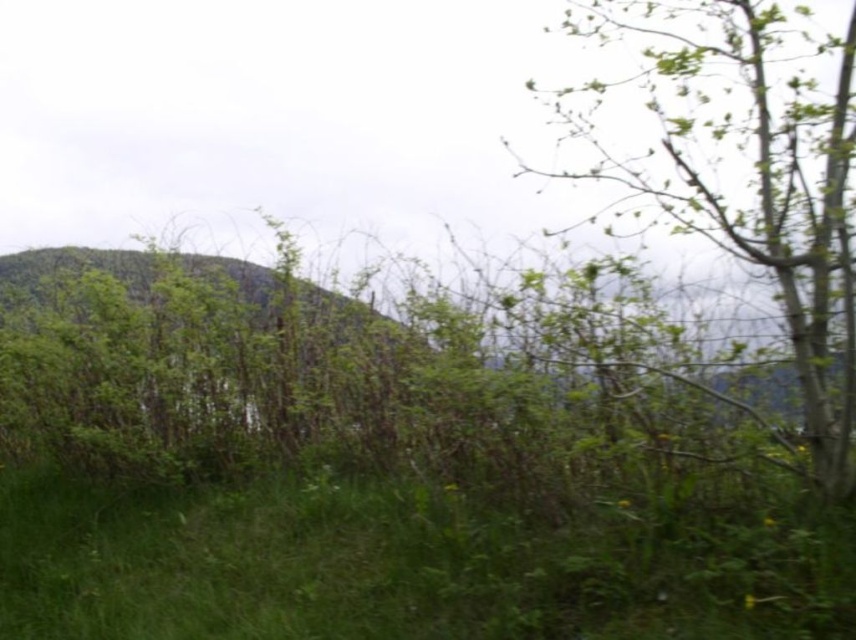
Question: Does green grassy at center have a larger size compared to green leafy tree at upper right?

Choices:
 (A) no
 (B) yes

Answer: (A)

Question: Observing the image, what is the correct spatial positioning of green grassy at center in reference to green leafy tree at upper right?

Choices:
 (A) right
 (B) left

Answer: (B)

Question: Is green grassy at center closer to the viewer compared to green leafy tree at upper right?

Choices:
 (A) yes
 (B) no

Answer: (A)

Question: Which point is farther to the camera?

Choices:
 (A) green grassy at center
 (B) green leafy tree at upper right

Answer: (B)